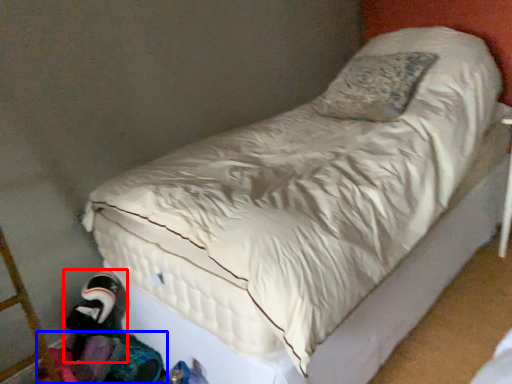
Question: Among these objects, which one is farthest to the camera, toy (highlighted by a red box) or clothing (highlighted by a blue box)?

Choices:
 (A) toy
 (B) clothing

Answer: (A)